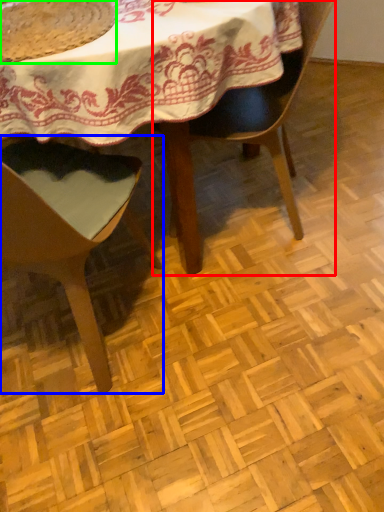
Question: Which is nearer to the chair (highlighted by a red box)? chair (highlighted by a blue box) or food (highlighted by a green box).

Choices:
 (A) chair
 (B) food

Answer: (A)